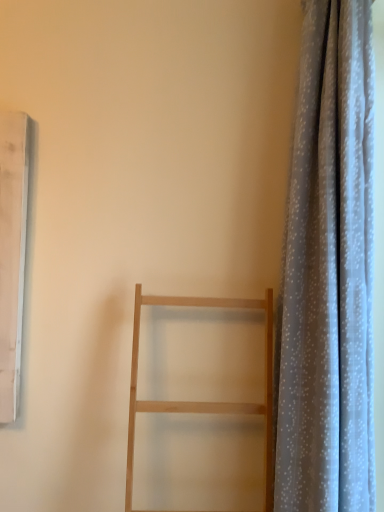
This screenshot has height=512, width=384. Identify the location of natural wood ladder at center. (201, 402).

The width and height of the screenshot is (384, 512). What do you see at coordinates (201, 402) in the screenshot?
I see `natural wood ladder at center` at bounding box center [201, 402].

At what (x,y) coordinates should I click in order to perform the action: click on light gray sheer curtain at right. Please return your answer as a coordinate pair (x, y). This screenshot has width=384, height=512. Looking at the image, I should click on (328, 273).

What is the approximate height of light gray sheer curtain at right?

The height of light gray sheer curtain at right is 4.93 feet.

What do you see at coordinates (328, 273) in the screenshot? The image size is (384, 512). I see `light gray sheer curtain at right` at bounding box center [328, 273].

At what (x,y) coordinates should I click in order to perform the action: click on natural wood ladder at center. Please return your answer as a coordinate pair (x, y). Image resolution: width=384 pixels, height=512 pixels. Looking at the image, I should click on (201, 402).

Between light gray sheer curtain at right and natural wood ladder at center, which one appears on the left side from the viewer's perspective?

Positioned to the left is natural wood ladder at center.

Is the depth of light gray sheer curtain at right greater than that of natural wood ladder at center?

Yes, it is.

Which point is more forward, (339, 473) or (268, 397)?

Point (339, 473)

From the image's perspective, is light gray sheer curtain at right below natural wood ladder at center?

Incorrect, from the image's perspective, light gray sheer curtain at right is higher than natural wood ladder at center.

From a real-world perspective, is light gray sheer curtain at right located beneath natural wood ladder at center?

No, from a real-world perspective, light gray sheer curtain at right is not under natural wood ladder at center.

Considering the sizes of light gray sheer curtain at right and natural wood ladder at center in the image, is light gray sheer curtain at right wider or thinner than natural wood ladder at center?

In the image, light gray sheer curtain at right appears to be more narrow than natural wood ladder at center.

Is light gray sheer curtain at right shorter than natural wood ladder at center?

In fact, light gray sheer curtain at right may be taller than natural wood ladder at center.

Based on their sizes in the image, would you say light gray sheer curtain at right is bigger or smaller than natural wood ladder at center?

light gray sheer curtain at right is smaller than natural wood ladder at center.

Is natural wood ladder at center located within light gray sheer curtain at right?

No, natural wood ladder at center is not inside light gray sheer curtain at right.

Is light gray sheer curtain at right far away from natural wood ladder at center?

Actually, light gray sheer curtain at right and natural wood ladder at center are a little close together.

Based on the photo, could you tell me if light gray sheer curtain at right is facing natural wood ladder at center?

Yes, light gray sheer curtain at right faces towards natural wood ladder at center.

How many degrees apart are the facing directions of light gray sheer curtain at right and natural wood ladder at center?

There is a 88-degree angle between the facing directions of light gray sheer curtain at right and natural wood ladder at center.

The image size is (384, 512). I want to click on curtain that is above the natural wood ladder at center (from a real-world perspective), so click(328, 273).

Can you confirm if natural wood ladder at center is positioned to the left of light gray sheer curtain at right?

Indeed, natural wood ladder at center is positioned on the left side of light gray sheer curtain at right.

Considering the positions of objects natural wood ladder at center and light gray sheer curtain at right in the image provided, who is behind, natural wood ladder at center or light gray sheer curtain at right?

light gray sheer curtain at right is more distant.

Considering the points (266, 357) and (371, 27), which point is behind, point (266, 357) or point (371, 27)?

Point (266, 357)

From the image's perspective, relative to light gray sheer curtain at right, is natural wood ladder at center above or below?

From the image's perspective, natural wood ladder at center appears below light gray sheer curtain at right.

From a real-world perspective, does natural wood ladder at center stand above light gray sheer curtain at right?

No, from a real-world perspective, natural wood ladder at center is not over light gray sheer curtain at right

Considering the sizes of objects natural wood ladder at center and light gray sheer curtain at right in the image provided, who is thinner, natural wood ladder at center or light gray sheer curtain at right?

Result: light gray sheer curtain at right.

Can you confirm if natural wood ladder at center is taller than light gray sheer curtain at right?

Incorrect, the height of natural wood ladder at center is not larger of that of light gray sheer curtain at right.

Is natural wood ladder at center bigger or smaller than light gray sheer curtain at right?

natural wood ladder at center is bigger than light gray sheer curtain at right.

Is natural wood ladder at center not inside light gray sheer curtain at right?

Yes, natural wood ladder at center is not within light gray sheer curtain at right.

Is natural wood ladder at center beside light gray sheer curtain at right?

They are not placed beside each other.

Is natural wood ladder at center turned away from light gray sheer curtain at right?

No, light gray sheer curtain at right is not at the back of natural wood ladder at center.

Can you tell me how much natural wood ladder at center and light gray sheer curtain at right differ in facing direction?

They differ by 88 degrees in their facing directions.

You are a GUI agent. You are given a task and a screenshot of the screen. Output one action in this format:
    pyautogui.click(x=<x>, y=<y>)
    Task: Click on the curtain located on the right of natural wood ladder at center
    The image size is (384, 512).
    Given the screenshot: What is the action you would take?
    pyautogui.click(x=328, y=273)

You are a GUI agent. You are given a task and a screenshot of the screen. Output one action in this format:
    pyautogui.click(x=<x>, y=<y>)
    Task: Click on the curtain to the right of natural wood ladder at center
    
    Given the screenshot: What is the action you would take?
    pyautogui.click(x=328, y=273)

At what (x,y) coordinates should I click in order to perform the action: click on furniture in front of the light gray sheer curtain at right. Please return your answer as a coordinate pair (x, y). Looking at the image, I should click on tap(201, 402).